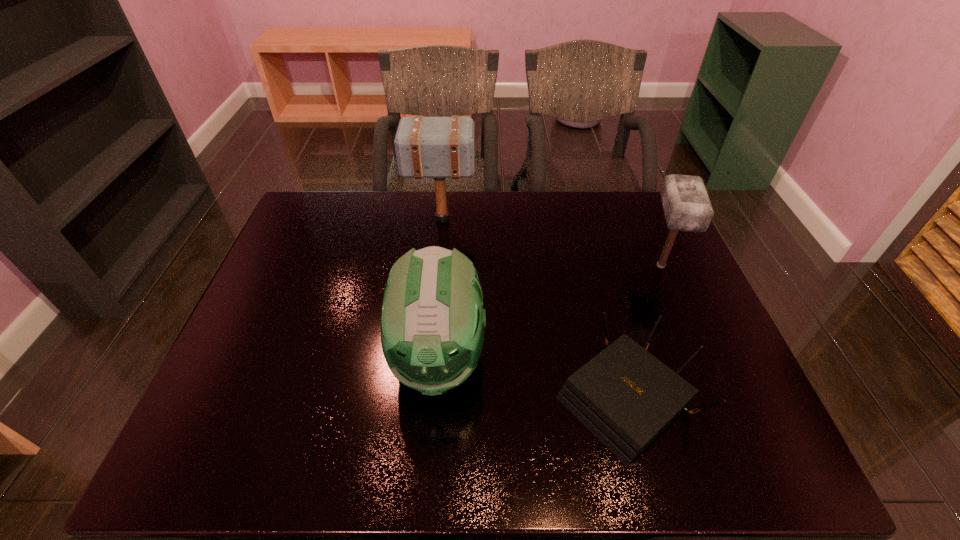
I want to click on object that is at the far edge, so [426, 147].

What are the coordinates of `object located in the near edge section of the desktop` in the screenshot? It's located at (625, 396).

Locate an element on the screen. The width and height of the screenshot is (960, 540). mallet situated at the right edge is located at coordinates (686, 204).

The height and width of the screenshot is (540, 960). Find the location of `router that is at the right edge`. router that is at the right edge is located at coordinates (625, 396).

Find the location of `object situated at the near right corner`. object situated at the near right corner is located at coordinates (625, 396).

Find the location of `vacant space at the far edge of the desktop`. vacant space at the far edge of the desktop is located at coordinates (593, 216).

Where is `vacant position at the left edge of the desktop`? The width and height of the screenshot is (960, 540). vacant position at the left edge of the desktop is located at coordinates (291, 313).

Where is `free location at the right edge`? This screenshot has width=960, height=540. free location at the right edge is located at coordinates (689, 315).

Find the location of a particular element. The height and width of the screenshot is (540, 960). free space at the far left corner is located at coordinates (322, 207).

Locate an element on the screen. The image size is (960, 540). free spot at the near left corner of the desktop is located at coordinates (237, 440).